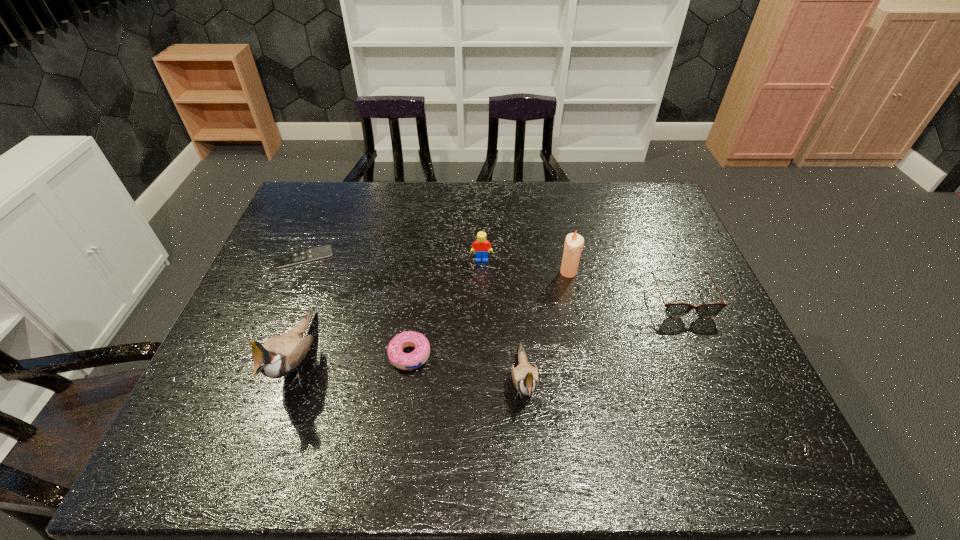
Find the location of a particular element. Image resolution: width=960 pixels, height=540 pixels. doughnut is located at coordinates (405, 361).

Where is `the second shortest object`? Image resolution: width=960 pixels, height=540 pixels. the second shortest object is located at coordinates (405, 361).

This screenshot has width=960, height=540. I want to click on vacant space located on the face of the fourth shortest object, so click(482, 359).

The width and height of the screenshot is (960, 540). I want to click on free space located on the left of the second object from right to left, so click(x=536, y=272).

The width and height of the screenshot is (960, 540). Identify the location of vacant region located 0.190m at the front view of the fifth tallest object. (717, 381).

Locate an element on the screen. vacant space located 0.270m on the front of the remote control is located at coordinates (268, 345).

I want to click on vacant region located 0.180m on the left of the doughnut, so click(315, 355).

This screenshot has height=540, width=960. Identify the location of bird that is at the left edge. (279, 355).

In order to click on remote control that is positioned at the left edge in this screenshot , I will do `click(321, 252)`.

At what (x,y) coordinates should I click in order to perform the action: click on object that is at the right edge. Please return your answer as a coordinate pair (x, y). The width and height of the screenshot is (960, 540). Looking at the image, I should click on (675, 310).